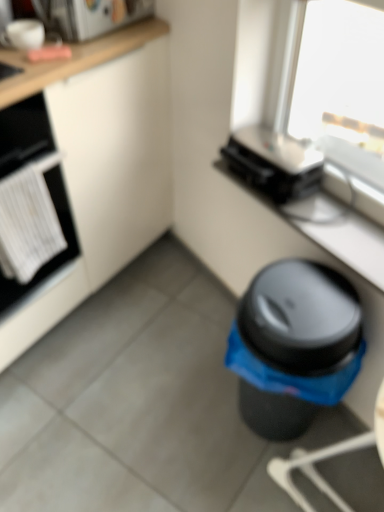
Question: Is matte black toaster at upper right next to black plastic toaster at upper center, which ranks as the 2th appliance in left-to-right order, and touching it?

Choices:
 (A) yes
 (B) no

Answer: (B)

Question: Can you confirm if matte black toaster at upper right is positioned to the right of black plastic toaster at upper center, which is counted as the second appliance, starting from the top?

Choices:
 (A) no
 (B) yes

Answer: (B)

Question: Is matte black toaster at upper right positioned before black plastic toaster at upper center, which ranks as the 2th appliance in left-to-right order?

Choices:
 (A) yes
 (B) no

Answer: (A)

Question: Is matte black toaster at upper right not inside black plastic toaster at upper center, arranged as the first appliance when ordered from the bottom?

Choices:
 (A) no
 (B) yes

Answer: (B)

Question: From the image's perspective, is matte black toaster at upper right on top of black plastic toaster at upper center, arranged as the first appliance when ordered from the bottom?

Choices:
 (A) yes
 (B) no

Answer: (B)

Question: Is matte black toaster at upper right oriented away from black plastic toaster at upper center, acting as the 1th appliance starting from the right?

Choices:
 (A) yes
 (B) no

Answer: (B)

Question: Is black plastic waste bin at lower right to the left of matte black toaster at upper right from the viewer's perspective?

Choices:
 (A) no
 (B) yes

Answer: (B)

Question: Considering the relative sizes of black plastic waste bin at lower right and matte black toaster at upper right in the image provided, is black plastic waste bin at lower right smaller than matte black toaster at upper right?

Choices:
 (A) no
 (B) yes

Answer: (A)

Question: Can you confirm if black plastic waste bin at lower right is bigger than matte black toaster at upper right?

Choices:
 (A) yes
 (B) no

Answer: (A)

Question: Is the position of black plastic waste bin at lower right more distant than that of matte black toaster at upper right?

Choices:
 (A) yes
 (B) no

Answer: (B)

Question: Would you say black plastic waste bin at lower right contains matte black toaster at upper right?

Choices:
 (A) yes
 (B) no

Answer: (B)

Question: Is black plastic waste bin at lower right not close to matte black toaster at upper right?

Choices:
 (A) no
 (B) yes

Answer: (A)

Question: From the image's perspective, is white matte cabinet at lower left on top of matte black toaster at upper right?

Choices:
 (A) yes
 (B) no

Answer: (A)